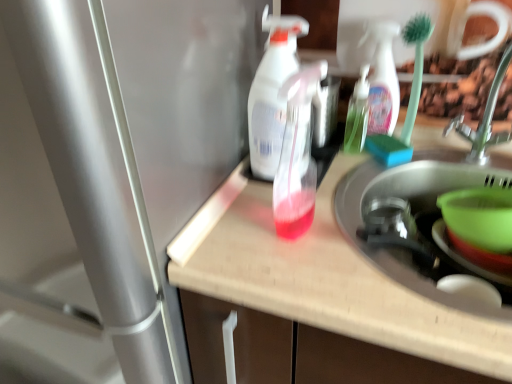
Locate an element on the screen. The image size is (512, 384). vacant space in front of translucent plastic spray bottle at center is located at coordinates (272, 222).